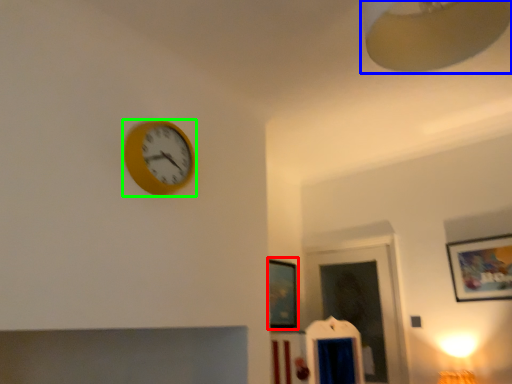
Question: Based on their relative distances, which object is farther from picture frame (highlighted by a red box)? Choose from lamp (highlighted by a blue box) and wall clock (highlighted by a green box).

Choices:
 (A) lamp
 (B) wall clock

Answer: (A)